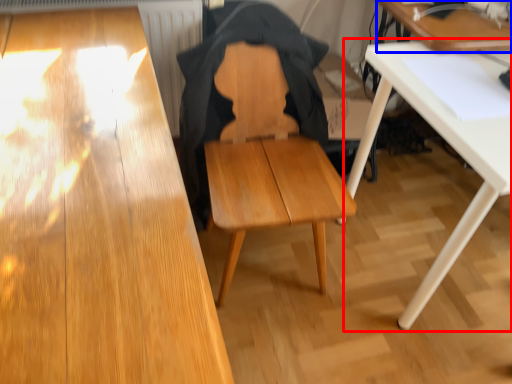
Question: Which of the following is the closest to the observer, table (highlighted by a red box) or table (highlighted by a blue box)?

Choices:
 (A) table
 (B) table

Answer: (A)